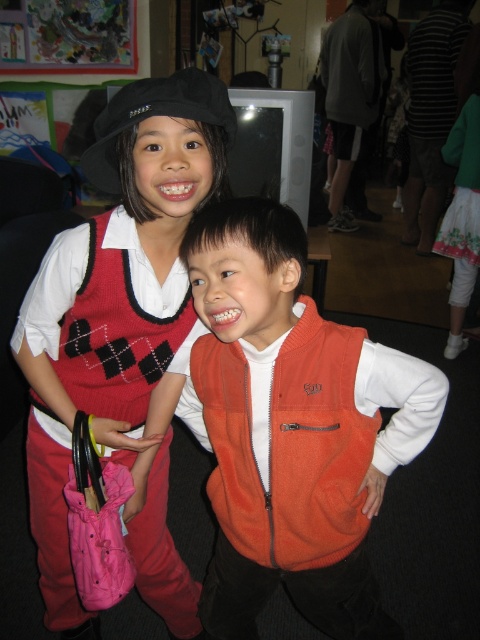
Which of these two, orange fleece vest at center or orange fleece safety vest at center, stands taller?

orange fleece vest at center is taller.

Does orange fleece vest at center have a smaller size compared to orange fleece safety vest at center?

Incorrect, orange fleece vest at center is not smaller in size than orange fleece safety vest at center.

The image size is (480, 640). What do you see at coordinates (289, 428) in the screenshot?
I see `orange fleece vest at center` at bounding box center [289, 428].

Where is `orange fleece vest at center`? orange fleece vest at center is located at coordinates (289, 428).

How far apart are knitted sweater vest at center and orange fleece safety vest at center?

knitted sweater vest at center and orange fleece safety vest at center are 9.28 inches apart from each other.

Looking at this image, between knitted sweater vest at center and orange fleece safety vest at center, which one is positioned higher?

orange fleece safety vest at center is above.

This screenshot has width=480, height=640. Describe the element at coordinates (122, 333) in the screenshot. I see `knitted sweater vest at center` at that location.

Identify the location of knitted sweater vest at center. (122, 333).

Does orange fleece vest at center appear under knitted sweater vest at center?

Yes.

Looking at this image, between orange fleece vest at center and knitted sweater vest at center, which one is positioned lower?

orange fleece vest at center is lower down.

Where is `orange fleece vest at center`? This screenshot has width=480, height=640. orange fleece vest at center is located at coordinates (289, 428).